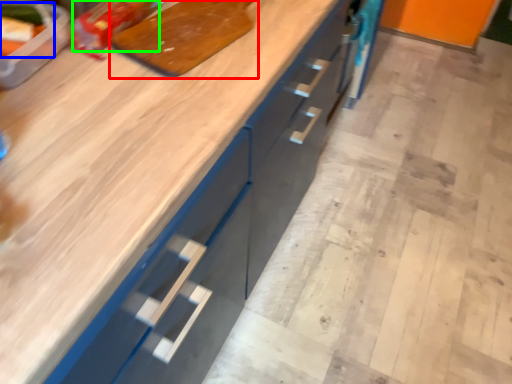
Question: Estimate the real-world distances between objects in this image. Which object is farther from cutting board (highlighted by a red box), food (highlighted by a blue box) or food (highlighted by a green box)?

Choices:
 (A) food
 (B) food

Answer: (A)